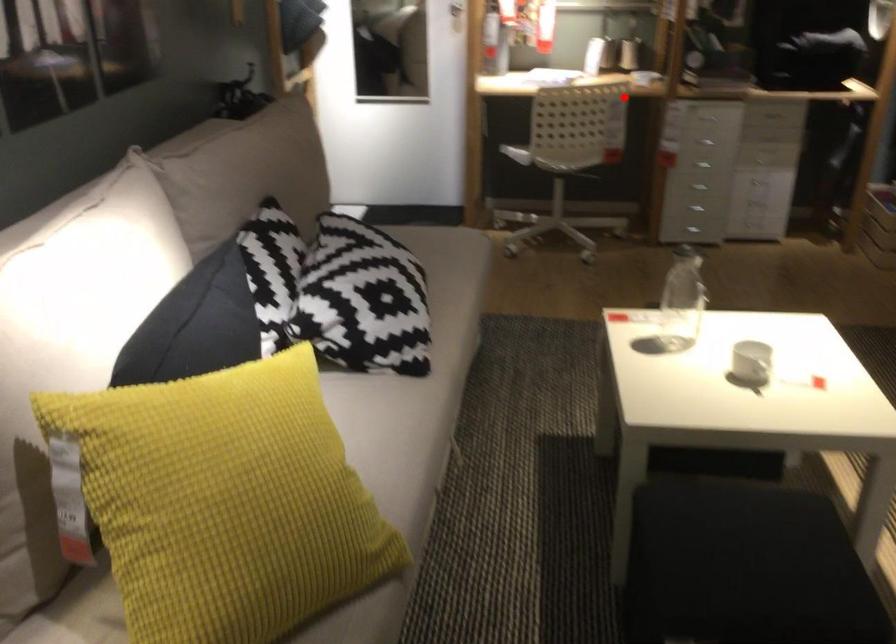
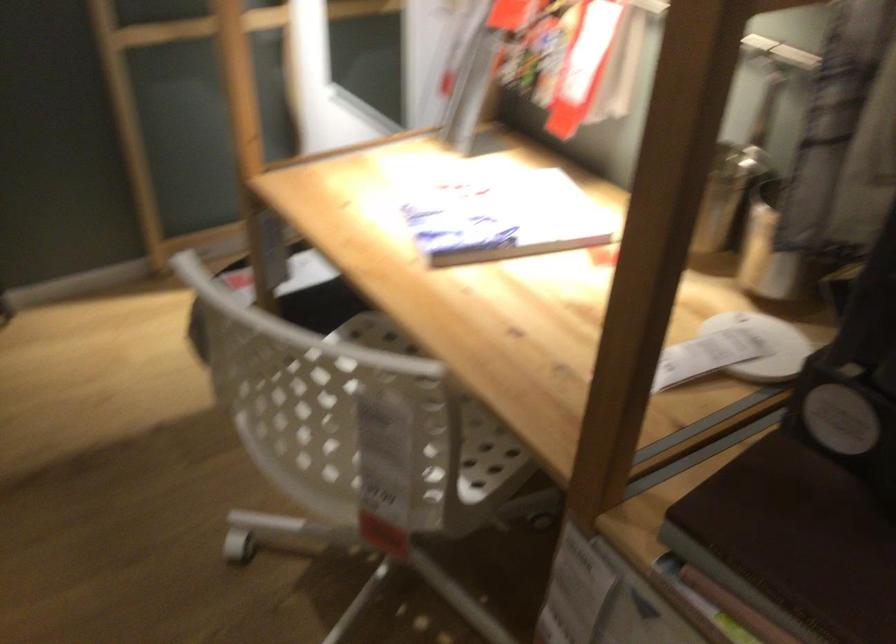
Question: I am providing you with two images of the same scene from different viewpoints. In image1, a red point is highlighted. Considering the same 3D point in image2, which of the following is correct?

Choices:
 (A) It is closer
 (B) It is farther

Answer: (A)